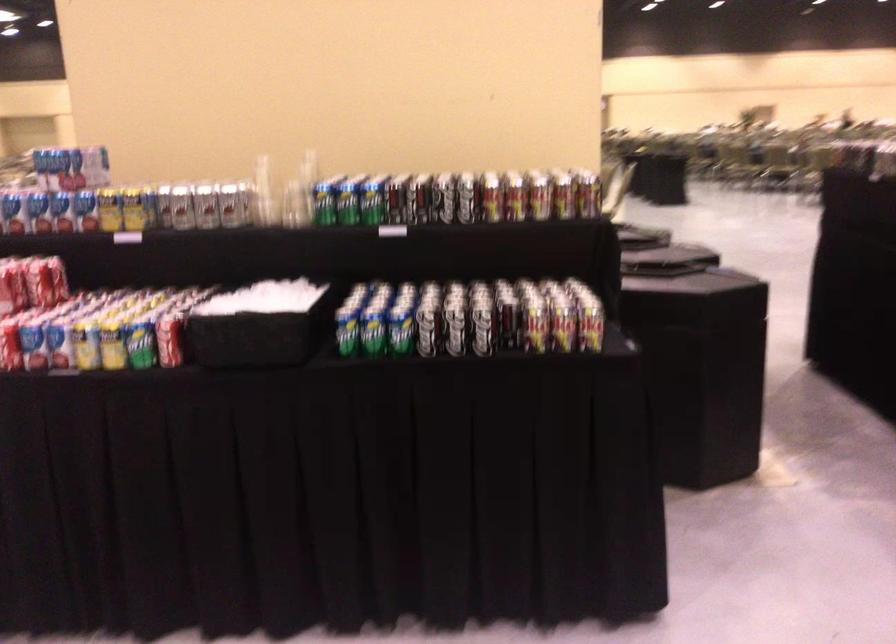
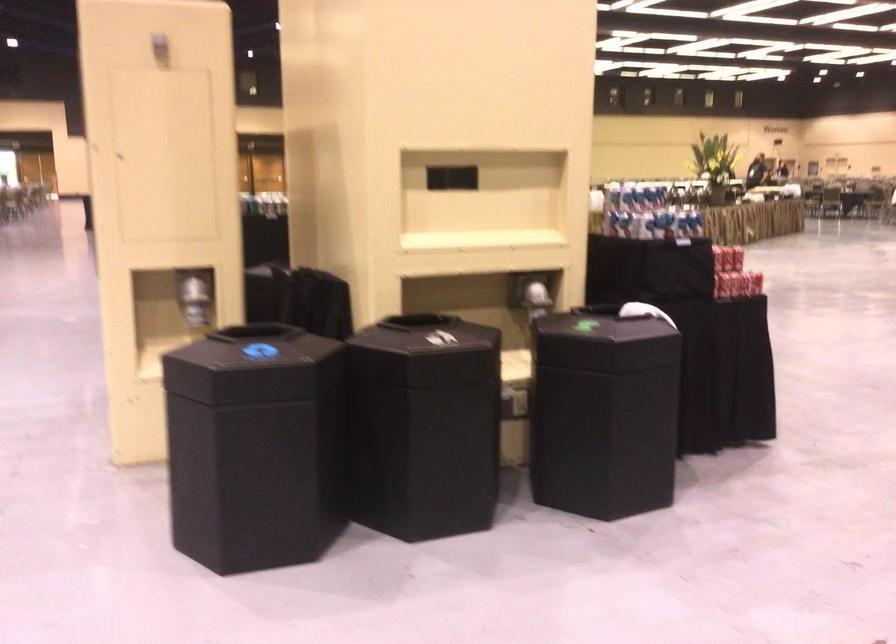
Question: I am providing you with two images of the same scene from different viewpoints. Which of the following objects are not visible in image2?

Choices:
 (A) red soda can
 (B) shiny dispenser lever
 (C) blue cabinet knob
 (D) black bin lid

Answer: (A)